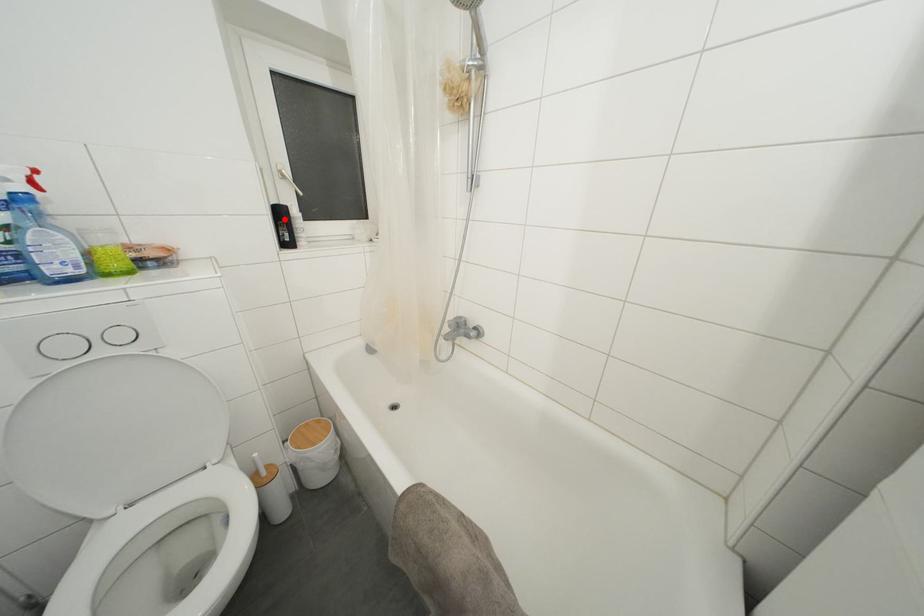
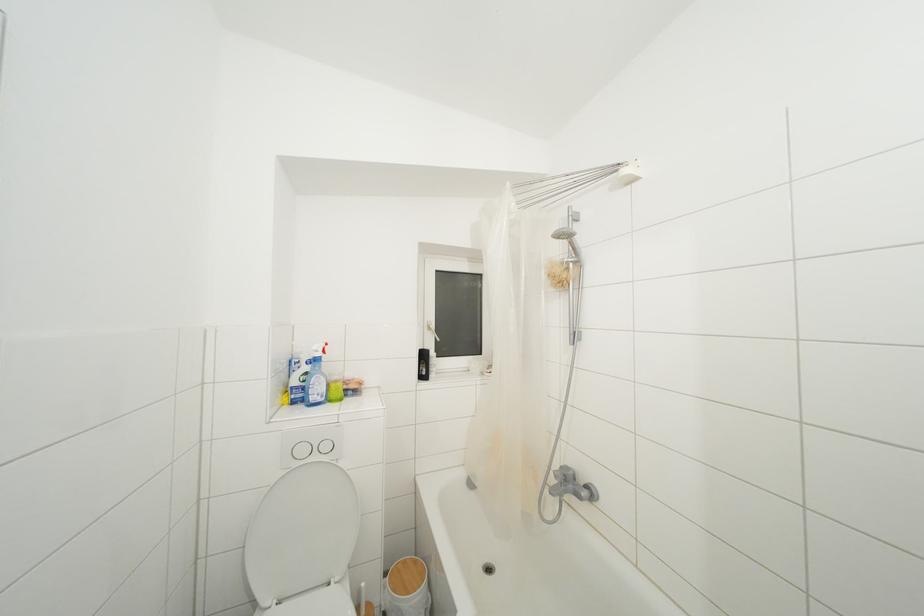
Question: I am providing you with two images of the same scene from different viewpoints. In image1, a red point is highlighted. Considering the same 3D point in image2, which of the following is correct?

Choices:
 (A) It is closer
 (B) It is farther

Answer: (B)